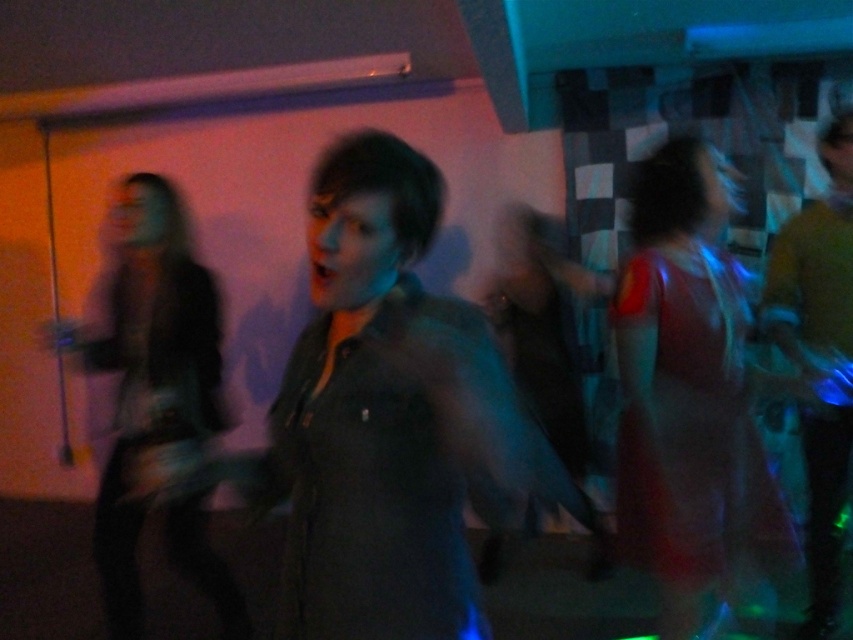
Question: Is dark gray shirt at center positioned behind shiny red dress at right?

Choices:
 (A) yes
 (B) no

Answer: (B)

Question: Which object is closer to the camera taking this photo?

Choices:
 (A) dark gray fabric jacket at left
 (B) shiny red dress at right
 (C) dark gray shirt at center

Answer: (C)

Question: Considering the relative positions of dark gray shirt at center and shiny red dress at right in the image provided, where is dark gray shirt at center located with respect to shiny red dress at right?

Choices:
 (A) below
 (B) above

Answer: (A)

Question: Can you confirm if shiny red dress at right is positioned to the left of dark gray fabric jacket at left?

Choices:
 (A) no
 (B) yes

Answer: (A)

Question: Among these objects, which one is farthest from the camera?

Choices:
 (A) shiny red dress at right
 (B) dark gray shirt at center
 (C) dark gray fabric jacket at left

Answer: (C)

Question: Which is nearer to the shiny red dress at right?

Choices:
 (A) dark gray shirt at center
 (B) dark gray fabric jacket at left

Answer: (A)